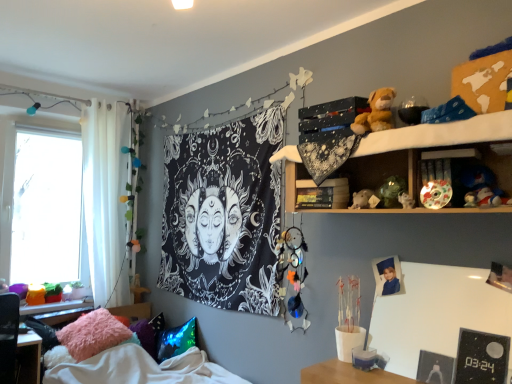
This screenshot has width=512, height=384. In order to click on free space above porcelain plate at upper right (from a real-world perspective) in this screenshot , I will do `click(449, 149)`.